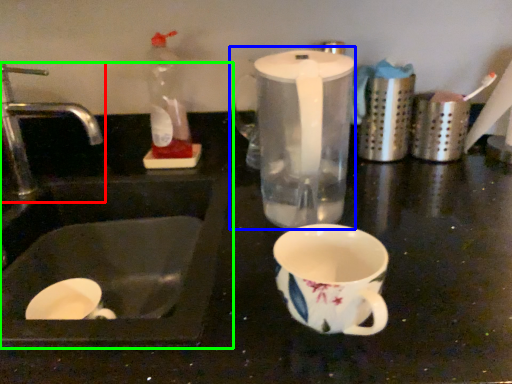
Question: Which is nearer to the tap (highlighted by a red box)? blender (highlighted by a blue box) or sink (highlighted by a green box).

Choices:
 (A) blender
 (B) sink

Answer: (B)